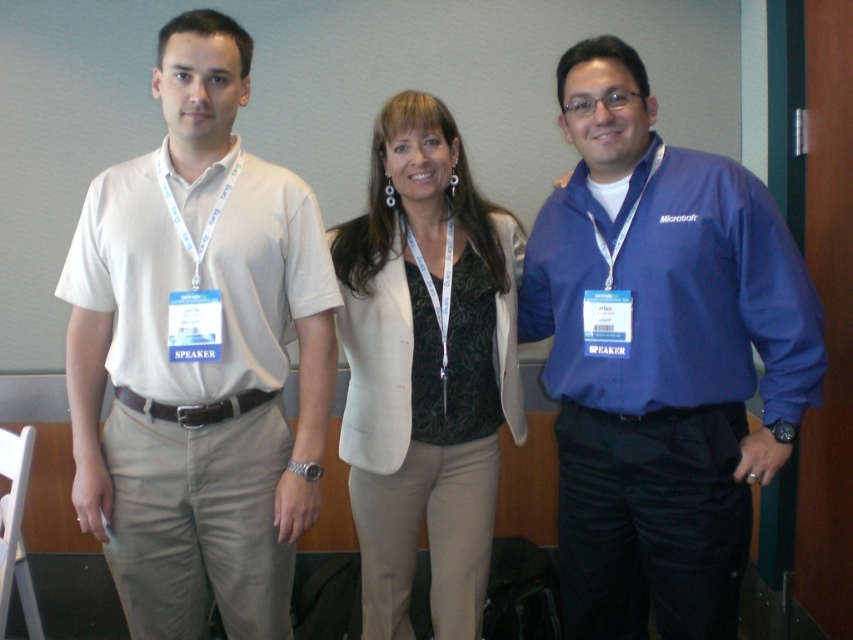
Is matte white shirt at left further to camera compared to blue fabric shirt at right?

No, it is not.

At what (x,y) coordinates should I click in order to perform the action: click on matte white shirt at left. Please return your answer as a coordinate pair (x, y). This screenshot has width=853, height=640. Looking at the image, I should click on (198, 355).

Where is `matte white shirt at left`? The width and height of the screenshot is (853, 640). matte white shirt at left is located at coordinates (198, 355).

Identify the location of blue fabric shirt at right. (660, 356).

Between point (599, 145) and point (440, 416), which one is positioned in front?

Point (599, 145) is more forward.

Image resolution: width=853 pixels, height=640 pixels. Describe the element at coordinates (660, 356) in the screenshot. I see `blue fabric shirt at right` at that location.

Identify the location of blue fabric shirt at right. [x=660, y=356].

In the scene shown: Does matte white shirt at left appear on the right side of matte white blazer at center?

In fact, matte white shirt at left is to the left of matte white blazer at center.

Which is behind, point (242, 547) or point (462, 248)?

The point (462, 248) is more distant.

Who is more forward, (270,596) or (500,250)?

Positioned in front is point (270,596).

Identify the location of matte white shirt at left. This screenshot has height=640, width=853. (198, 355).